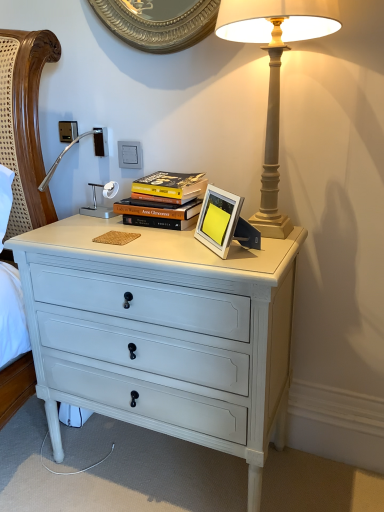
This screenshot has height=512, width=384. Find the location of `free spot to the left of silver metallic picture frame at center`. free spot to the left of silver metallic picture frame at center is located at coordinates (166, 243).